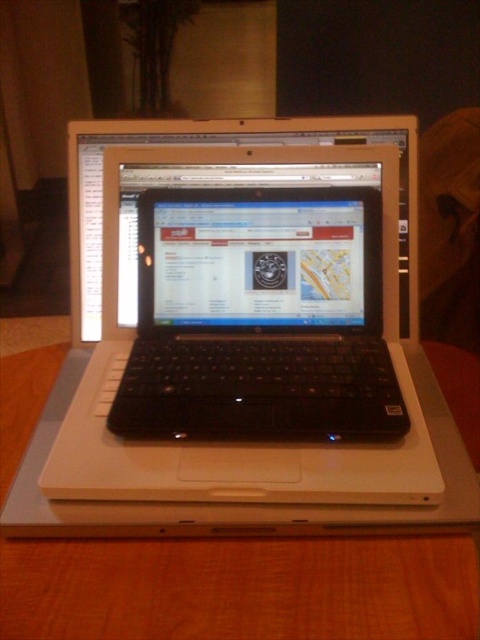
You have a rectangular box that is 15 inches wide. You want to place it on the wooden table at center. Can the black matte laptop at center also be placed on the same table without overlapping the box?

The black matte laptop at center has a width less than the wooden table at center, so it can be placed on the table without overlapping the box as long as there is enough space remaining.

In the scene shown: You are standing in front of the laptops and want to reach the point at coordinates point (300,342). If your hand can extend 60 centimeters, can you reach it?

The point (300,342) is 70.33 centimeters away from the camera, so your hand can only extend 60 centimeters, meaning you cannot reach it.

You are organizing a workspace and need to place a new monitor between the black matte laptop at center and the wooden table at center. Based on their positions, where should the monitor be placed?

The black matte laptop at center is to the right of the wooden table at center, so the monitor should be placed between them, to the right of the wooden table at center and to the left of the black matte laptop at center.